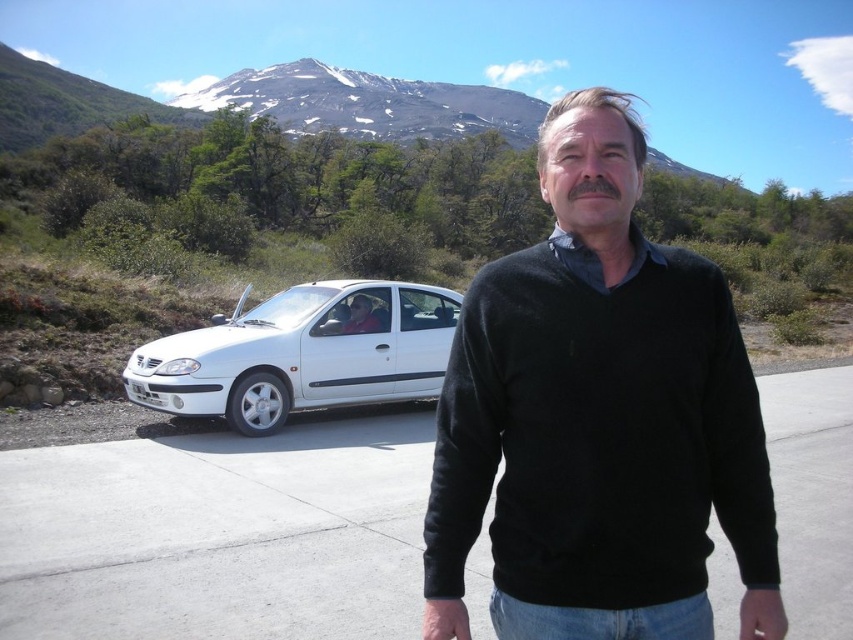
Question: Which of the following is the closest to the observer?

Choices:
 (A) (345, 291)
 (B) (485, 104)
 (C) (524, 348)

Answer: (C)

Question: Does white matte sedan at left appear under snowy volcanic peak at upper center?

Choices:
 (A) no
 (B) yes

Answer: (B)

Question: Among these objects, which one is nearest to the camera?

Choices:
 (A) snowy volcanic peak at upper center
 (B) white matte sedan at left
 (C) black sweater at center

Answer: (C)

Question: Can you confirm if white matte sedan at left is smaller than snowy volcanic peak at upper center?

Choices:
 (A) no
 (B) yes

Answer: (B)

Question: Observing the image, what is the correct spatial positioning of white matte sedan at left in reference to snowy volcanic peak at upper center?

Choices:
 (A) below
 (B) above

Answer: (A)

Question: Which object appears farthest from the camera in this image?

Choices:
 (A) white matte sedan at left
 (B) snowy volcanic peak at upper center

Answer: (B)